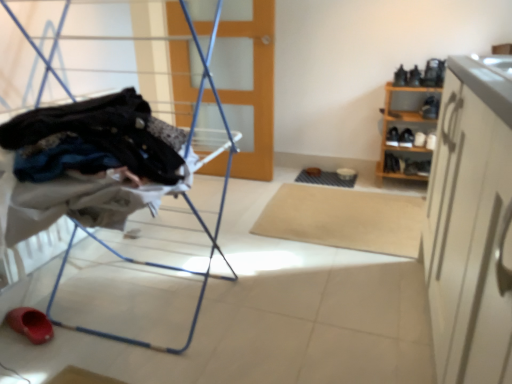
Find the location of a particular element. This screenshot has width=512, height=384. free area in between metal laundry rack at left and beige carpet at center is located at coordinates (271, 258).